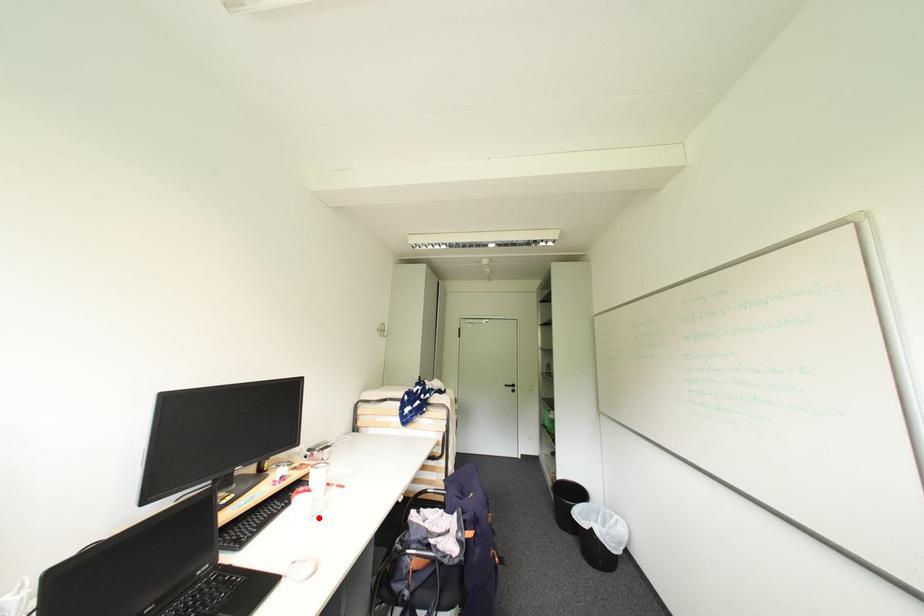
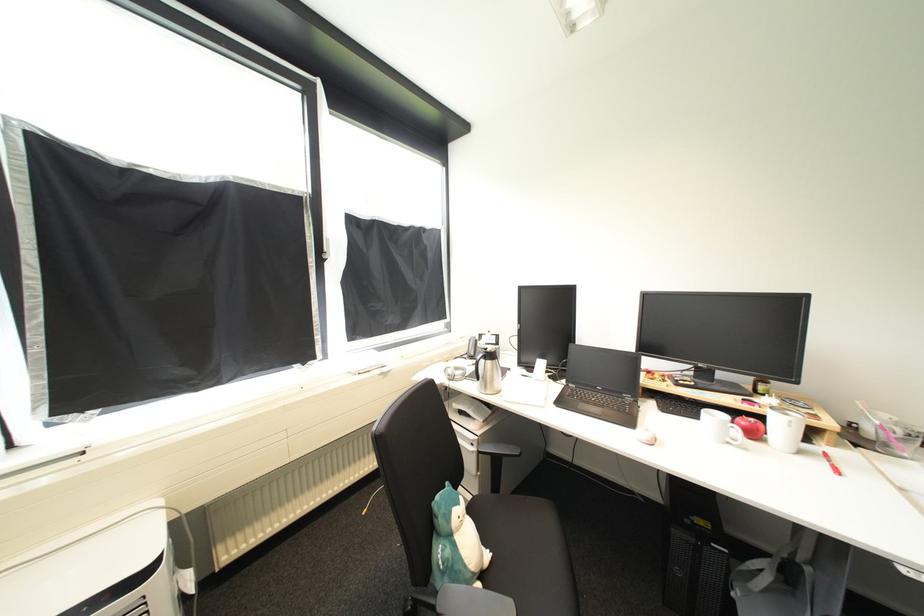
In the second image, find the point that corresponds to the highlighted location in the first image.

(736, 445)